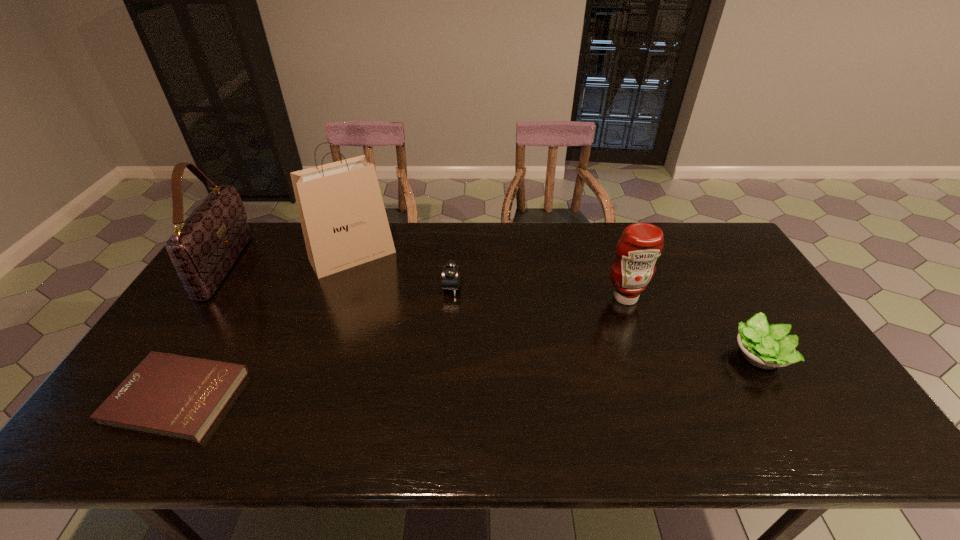
Locate an element on the screen. object that is at the near left corner is located at coordinates (180, 397).

The image size is (960, 540). Find the location of `vacant region at the far edge of the desktop`. vacant region at the far edge of the desktop is located at coordinates (448, 230).

In the image, there is a desktop. Where is `vacant space at the near edge`? vacant space at the near edge is located at coordinates (433, 421).

Locate an element on the screen. free region at the left edge is located at coordinates (239, 304).

In the image, there is a desktop. At what (x,y) coordinates should I click in order to perform the action: click on vacant space at the far left corner. Please return your answer as a coordinate pair (x, y). This screenshot has width=960, height=540. Looking at the image, I should click on (265, 245).

This screenshot has width=960, height=540. Identify the location of free location at the far right corner. (718, 250).

Locate an element on the screen. Image resolution: width=960 pixels, height=540 pixels. vacant area at the near right corner of the desktop is located at coordinates (858, 418).

Image resolution: width=960 pixels, height=540 pixels. In order to click on free point between the shopping bag and the handbag in this screenshot , I will do `click(289, 261)`.

Find the location of a particular element. The height and width of the screenshot is (540, 960). free point between the third object from left to right and the shortest object is located at coordinates (265, 326).

Where is `free area in between the alarm clock and the lettuce`? free area in between the alarm clock and the lettuce is located at coordinates [x=606, y=322].